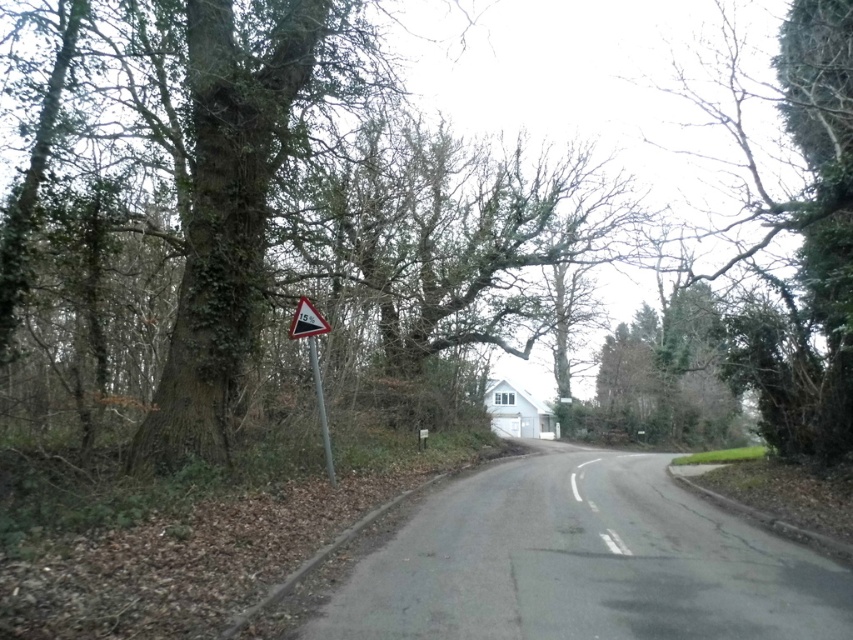
Question: Considering the relative positions of black plastic triangle at left and metal pole at left in the image provided, where is black plastic triangle at left located with respect to metal pole at left?

Choices:
 (A) below
 (B) above

Answer: (B)

Question: Which is farther from the metal pole at left?

Choices:
 (A) green leafy tree at upper right
 (B) white plastic speed limit sign at center-left

Answer: (A)

Question: Is black plastic triangle at left smaller than white plastic speed limit sign at center-left?

Choices:
 (A) no
 (B) yes

Answer: (A)

Question: Which object is closer to the camera taking this photo?

Choices:
 (A) green leafy tree at upper right
 (B) black plastic triangle at left
 (C) metal pole at left
 (D) white plastic speed limit sign at center-left

Answer: (A)

Question: From the image, what is the correct spatial relationship of metal pole at left in relation to white plastic speed limit sign at center-left?

Choices:
 (A) right
 (B) left

Answer: (A)

Question: Which of the following is the closest to the observer?

Choices:
 (A) (318, 381)
 (B) (306, 300)
 (C) (329, 452)

Answer: (A)